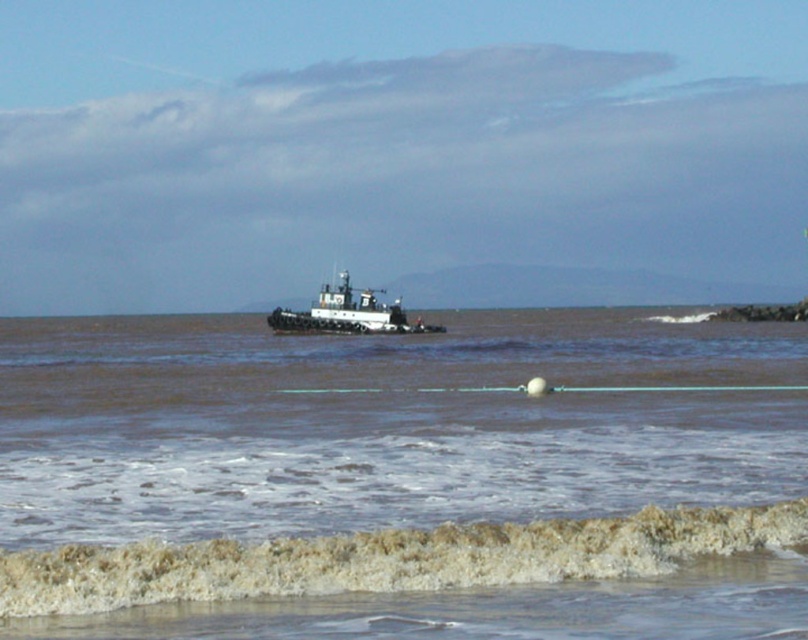
Can you confirm if brown matte water at center is bigger than white matte tugboat at center?

Yes.

Which is behind, point (777, 508) or point (407, 332)?

The point (407, 332) is more distant.

In order to click on brown matte water at center in this screenshot , I will do `click(404, 477)`.

Does frothy white foam at lower center come behind white matte tugboat at center?

No.

Where is `frothy white foam at lower center`? The width and height of the screenshot is (808, 640). frothy white foam at lower center is located at coordinates coord(386,557).

Does brown matte water at center have a larger size compared to frothy white foam at lower center?

Yes, brown matte water at center is bigger than frothy white foam at lower center.

Describe the element at coordinates (404, 477) in the screenshot. I see `brown matte water at center` at that location.

Does point (22, 440) come closer to viewer compared to point (99, 564)?

That is False.

Find the location of a particular element. The width and height of the screenshot is (808, 640). brown matte water at center is located at coordinates (404, 477).